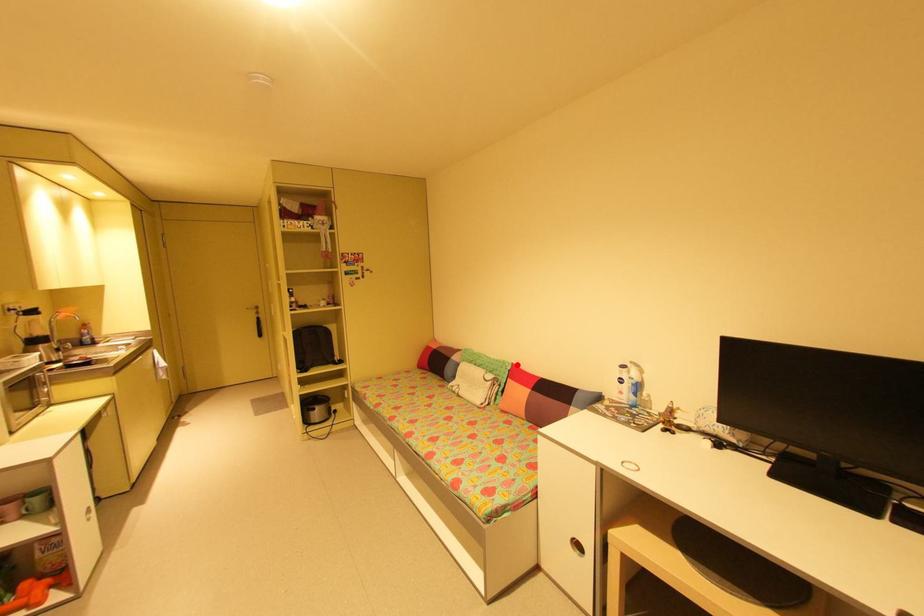
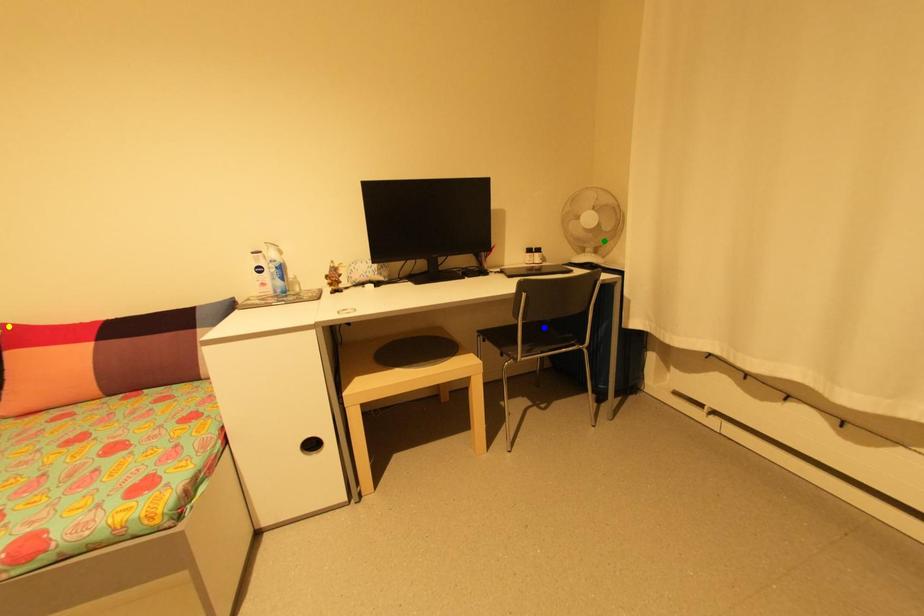
Question: I am providing you with two images of the same scene from different viewpoints. A red point is marked on the first image. You are given multiple points on the second image. Which point in image 2 is actually the same real-world point as the red point in image 1?

Choices:
 (A) yellow point
 (B) green point
 (C) blue point

Answer: (A)